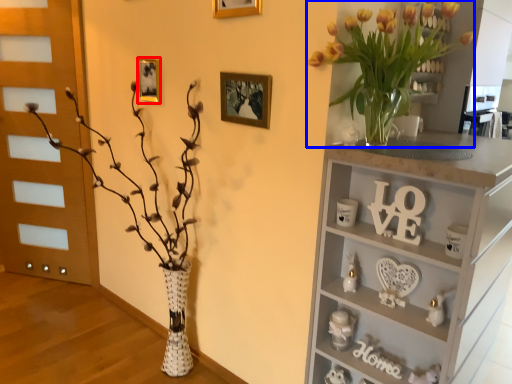
Question: Which of the following is the farthest to the observer, picture frame (highlighted by a red box) or floral arrangement (highlighted by a blue box)?

Choices:
 (A) picture frame
 (B) floral arrangement

Answer: (A)